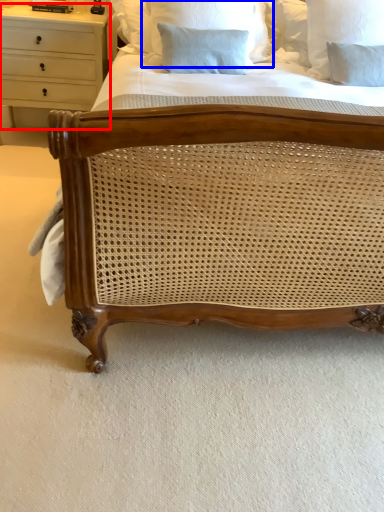
Question: Which object appears farthest to the camera in this image, chest of drawers (highlighted by a red box) or pillow (highlighted by a blue box)?

Choices:
 (A) chest of drawers
 (B) pillow

Answer: (A)